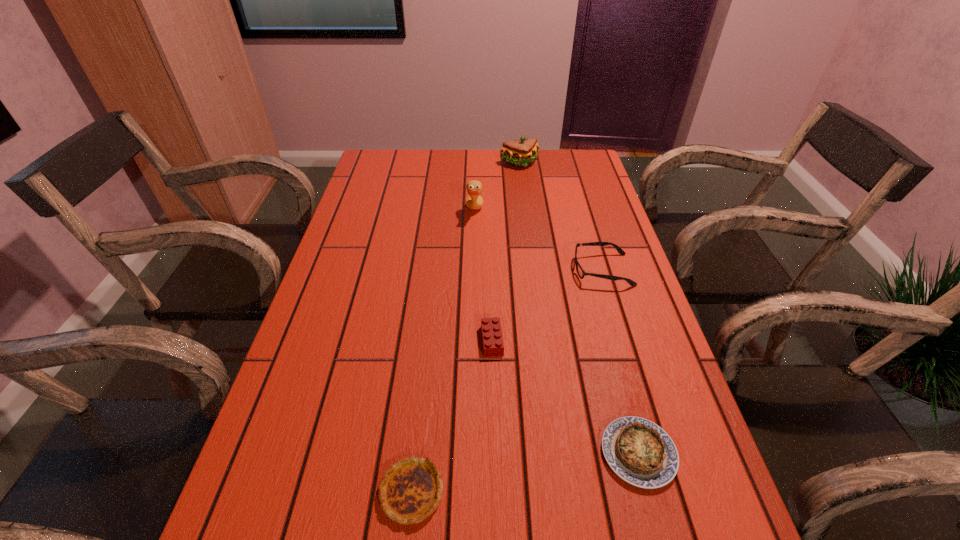
Where is `vacant space that's between the farthest object and the fourth tallest object`? vacant space that's between the farthest object and the fourth tallest object is located at coordinates (506, 252).

The width and height of the screenshot is (960, 540). I want to click on vacant space that's between the farthest object and the duck, so click(497, 187).

Locate an element on the screen. The image size is (960, 540). vacant space in between the farthest object and the third nearest object is located at coordinates (506, 252).

This screenshot has height=540, width=960. I want to click on the fourth closest object to the right quiche, so click(474, 200).

Locate which object ranks third in proximity to the fourth object from left to right. Please provide its 2D coordinates. Your answer should be formatted as a tuple, i.e. [(x, y)], where the tuple contains the x and y coordinates of a point satisfying the conditions above.

[(493, 345)]

What are the coordinates of `vacant position in the image that satisfies the following two spatial constraints: 1. on the front side of the sandwich; 2. on the left side of the right quiche` in the screenshot? It's located at (559, 453).

Locate an element on the screen. This screenshot has height=540, width=960. vacant space that satisfies the following two spatial constraints: 1. on the back side of the left quiche; 2. on the left side of the Lego is located at coordinates (428, 341).

I want to click on vacant space that satisfies the following two spatial constraints: 1. on the beak of the fourth farthest object; 2. on the right side of the duck, so click(x=472, y=341).

Identify the location of vacant space that satisfies the following two spatial constraints: 1. on the beak of the duck; 2. on the right side of the third shortest object. (x=472, y=341).